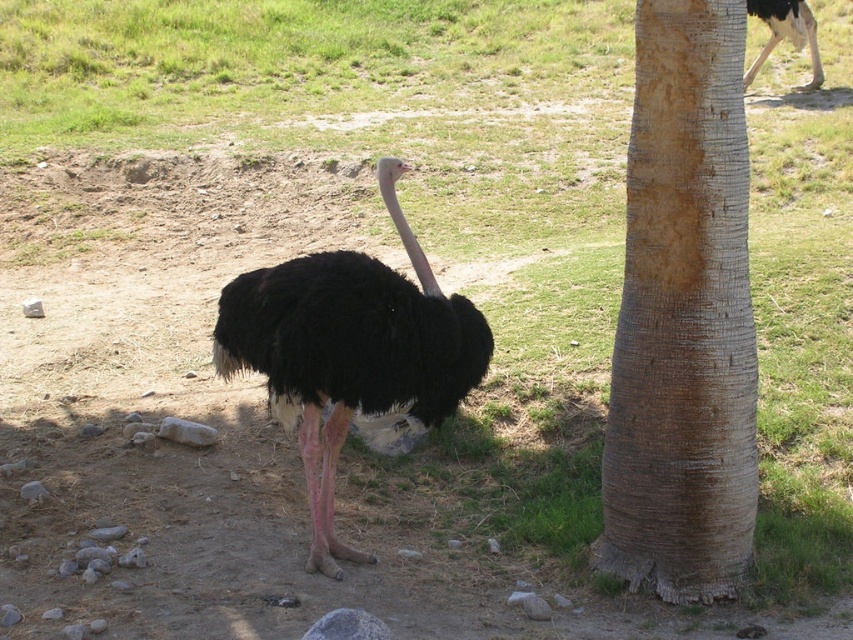
Who is more forward, (734, 336) or (393, 172)?

Positioned in front is point (734, 336).

Find the location of a particular element. brown rough bark at right is located at coordinates click(683, 316).

Is brown rough bark at right to the left of black feathered ostrich at center from the viewer's perspective?

No, brown rough bark at right is not to the left of black feathered ostrich at center.

Does point (706, 273) come farther from viewer compared to point (325, 349)?

Yes, it is.

Image resolution: width=853 pixels, height=640 pixels. What do you see at coordinates (683, 316) in the screenshot?
I see `brown rough bark at right` at bounding box center [683, 316].

Where is `brown rough bark at right`? brown rough bark at right is located at coordinates (683, 316).

In the scene shown: Does black feathered ostrich at center have a lesser width compared to black feathered head at center?

In fact, black feathered ostrich at center might be wider than black feathered head at center.

Is point (334, 422) farther from camera compared to point (392, 192)?

That is True.

You are a GUI agent. You are given a task and a screenshot of the screen. Output one action in this format:
    pyautogui.click(x=<x>, y=<y>)
    Task: Click on the black feathered ostrich at center
    
    Given the screenshot: What is the action you would take?
    pyautogui.click(x=347, y=355)